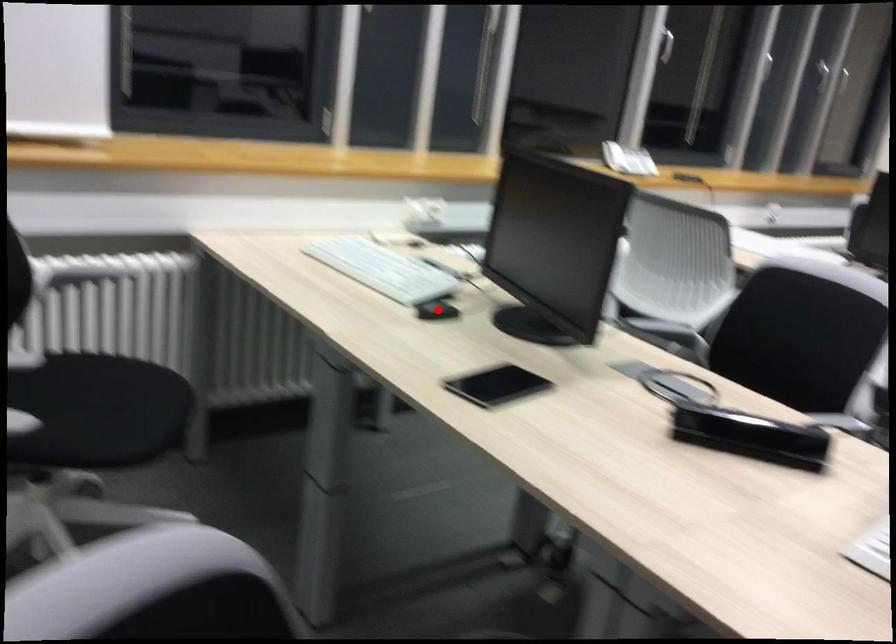
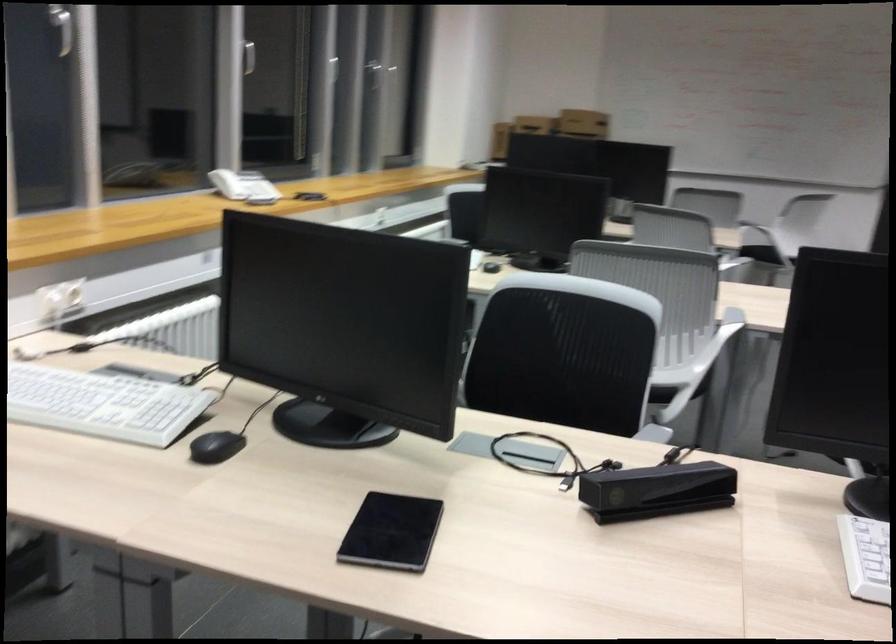
Question: I am providing you with two images of the same scene from different viewpoints. Image1 has a red point marked. In image2, the corresponding 3D location appears at what relative position? Reply with the corresponding letter.

Choices:
 (A) Closer
 (B) Farther

Answer: (A)